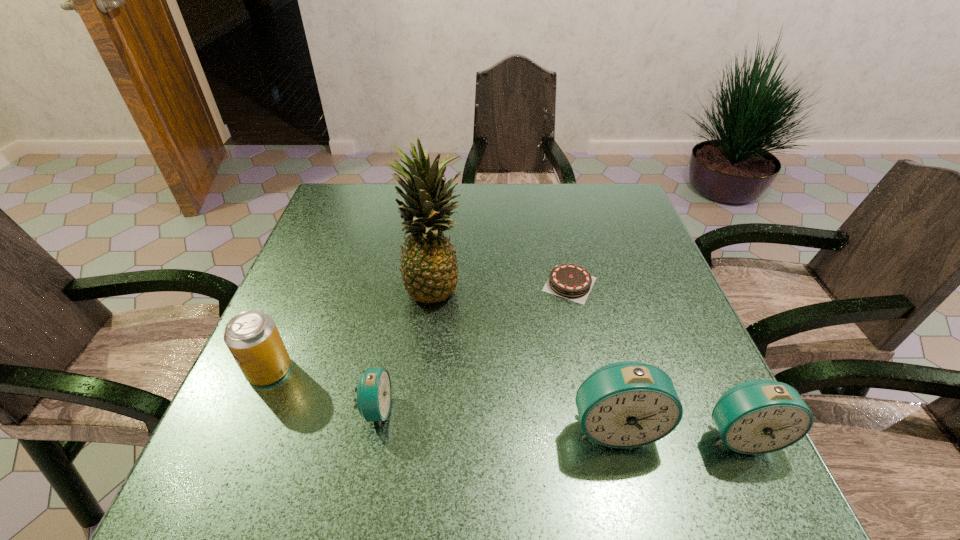
Identify the location of the second closest object relative to the second alarm clock from left to right. This screenshot has width=960, height=540. (569, 281).

This screenshot has height=540, width=960. Find the location of `alarm clock that is the closest one to the tallest object`. alarm clock that is the closest one to the tallest object is located at coordinates click(374, 392).

Where is `alarm clock that is the closest one to the second alarm clock from right to left`? This screenshot has width=960, height=540. alarm clock that is the closest one to the second alarm clock from right to left is located at coordinates (760, 416).